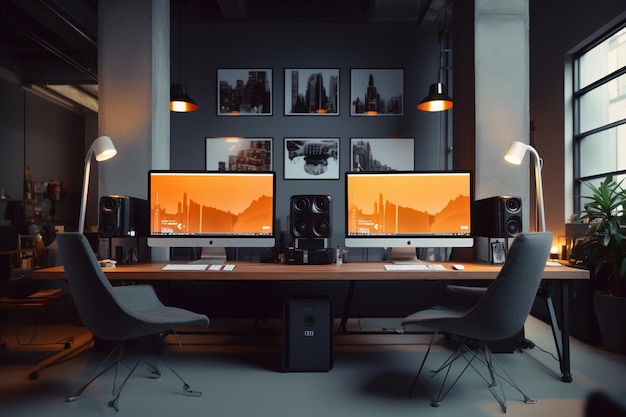
The image size is (626, 417). Identify the location of lamps. (514, 154), (105, 146).